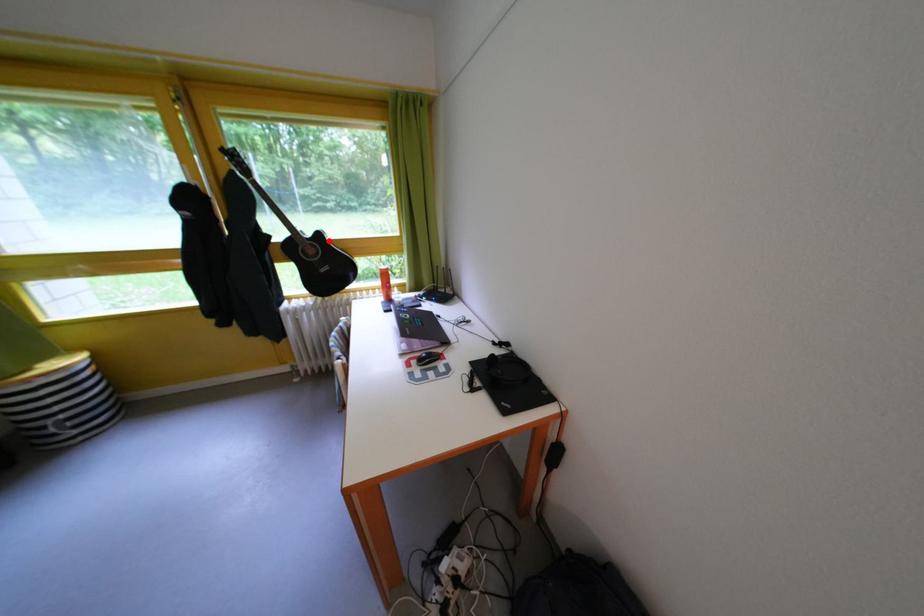
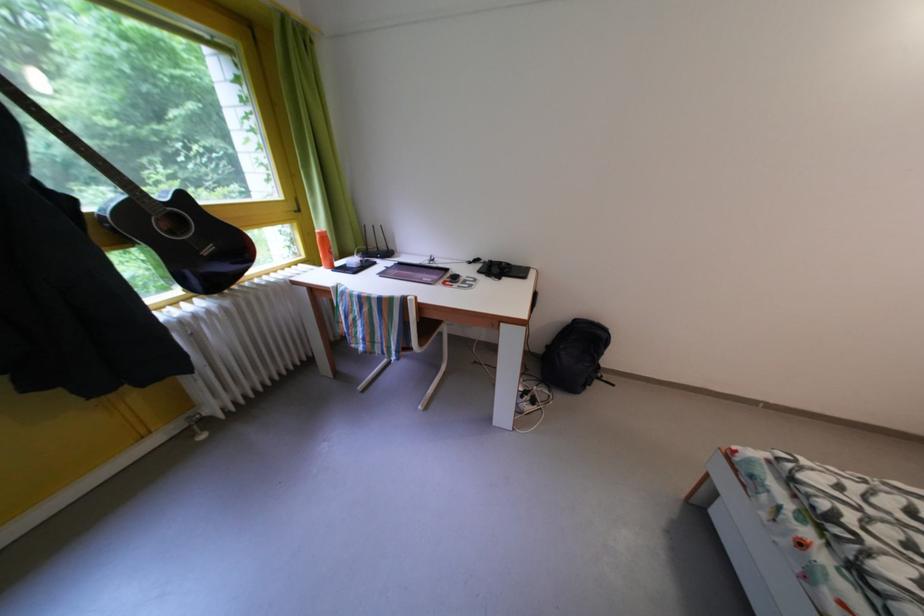
Question: I am providing you with two images of the same scene from different viewpoints. A red point is shown in image1. For the corresponding object point in image2, is it positioned nearer or farther from the camera?

Choices:
 (A) Nearer
 (B) Farther

Answer: (B)